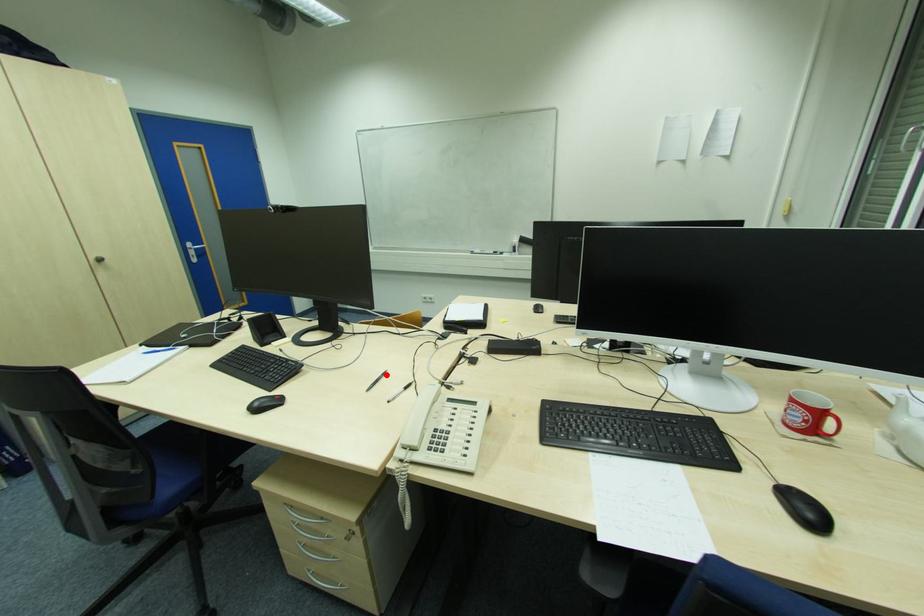
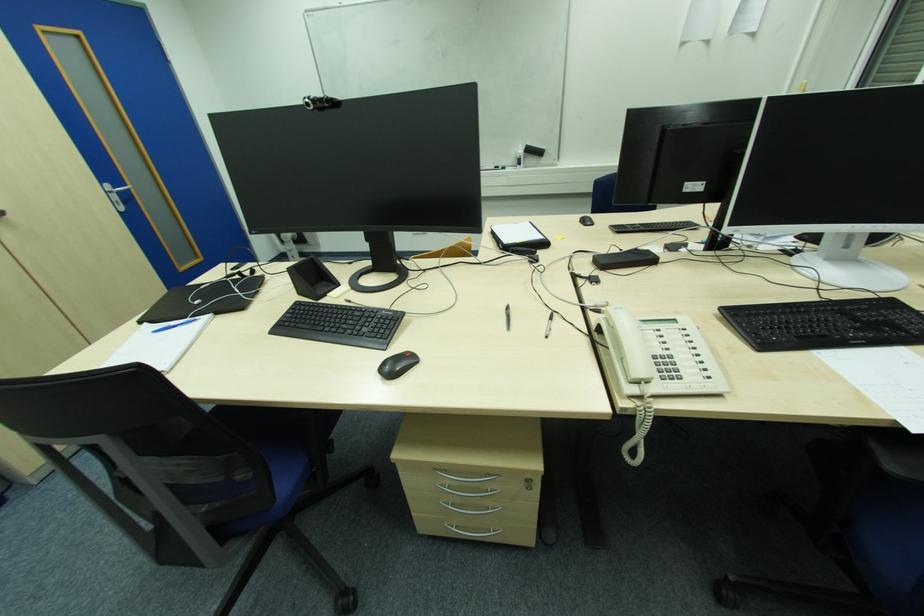
Where in the second image is the point corresponding to the highlighted location from the first image?

(509, 309)